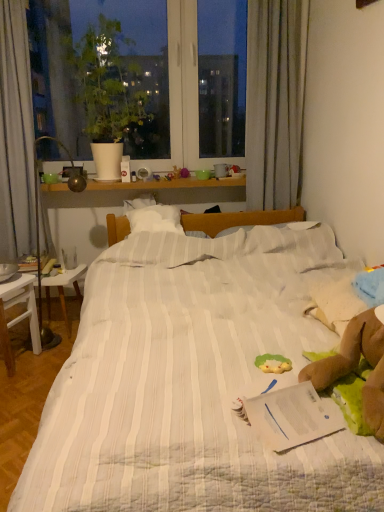
Question: Is green plush toy at center positioned with its back to white paper at center?

Choices:
 (A) no
 (B) yes

Answer: (A)

Question: Can you confirm if green plush toy at center is bigger than white paper at center?

Choices:
 (A) yes
 (B) no

Answer: (B)

Question: Is green plush toy at center far away from white paper at center?

Choices:
 (A) no
 (B) yes

Answer: (A)

Question: From the image's perspective, would you say green plush toy at center is shown under white paper at center?

Choices:
 (A) no
 (B) yes

Answer: (A)

Question: Is green plush toy at center thinner than white paper at center?

Choices:
 (A) yes
 (B) no

Answer: (A)

Question: Do you think white wooden table at left, placed as the second table when sorted from front to back, is within green plush toy at center, or outside of it?

Choices:
 (A) inside
 (B) outside

Answer: (B)

Question: Visually, is white wooden table at left, placed as the second table when sorted from front to back, positioned to the left or to the right of green plush toy at center?

Choices:
 (A) right
 (B) left

Answer: (B)

Question: Looking at their shapes, would you say white wooden table at left, placed as the second table when sorted from front to back, is wider or thinner than green plush toy at center?

Choices:
 (A) wide
 (B) thin

Answer: (A)

Question: From a real-world perspective, is white wooden table at left, the first table in the back-to-front sequence, physically located above or below green plush toy at center?

Choices:
 (A) below
 (B) above

Answer: (A)

Question: Visually, is white striped fabric bed at center positioned to the left or to the right of green matte plant at upper left?

Choices:
 (A) right
 (B) left

Answer: (A)

Question: Considering the positions of point (188, 488) and point (135, 82), is point (188, 488) closer or farther from the camera than point (135, 82)?

Choices:
 (A) farther
 (B) closer

Answer: (B)

Question: In terms of height, does white striped fabric bed at center look taller or shorter compared to green matte plant at upper left?

Choices:
 (A) tall
 (B) short

Answer: (B)

Question: From the image's perspective, is white striped fabric bed at center located above or below green matte plant at upper left?

Choices:
 (A) above
 (B) below

Answer: (B)

Question: Is point (301, 389) closer or farther from the camera than point (19, 316)?

Choices:
 (A) farther
 (B) closer

Answer: (B)

Question: Is white paper at center in front of or behind white wooden table at lower left, which is the 2th table from back to front, in the image?

Choices:
 (A) front
 (B) behind

Answer: (A)